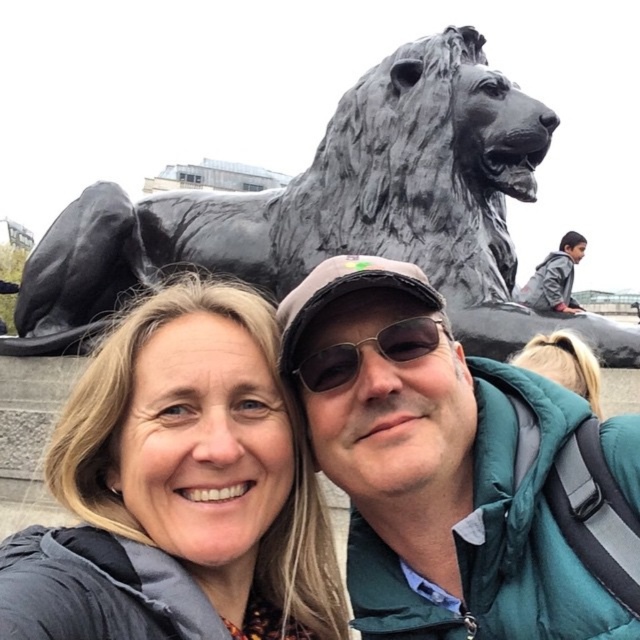
Question: Which point is closer to the camera taking this photo?

Choices:
 (A) (148, 483)
 (B) (524, 419)

Answer: (A)

Question: Is matte gray hair at center closer to the viewer compared to gray hoodie at upper right?

Choices:
 (A) no
 (B) yes

Answer: (B)

Question: Can you confirm if sunglasses at center is positioned below gray hoodie at upper right?

Choices:
 (A) no
 (B) yes

Answer: (B)

Question: Which point is farther to the camera?

Choices:
 (A) (332, 216)
 (B) (564, 337)
 (C) (406, 589)

Answer: (A)

Question: Considering the real-world distances, which object is closest to the gray hoodie at upper right?

Choices:
 (A) sunglasses at center
 (B) matte black jacket at center
 (C) matte gray hair at center
 (D) black polished stone lion at upper center

Answer: (D)

Question: Is matte gray hair at center above green puffy jacket at center?

Choices:
 (A) yes
 (B) no

Answer: (B)